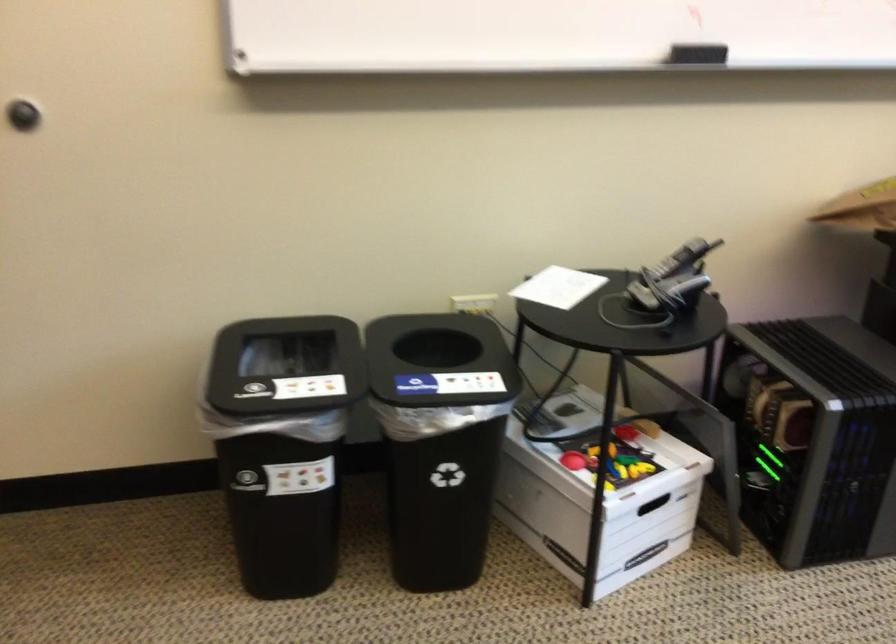
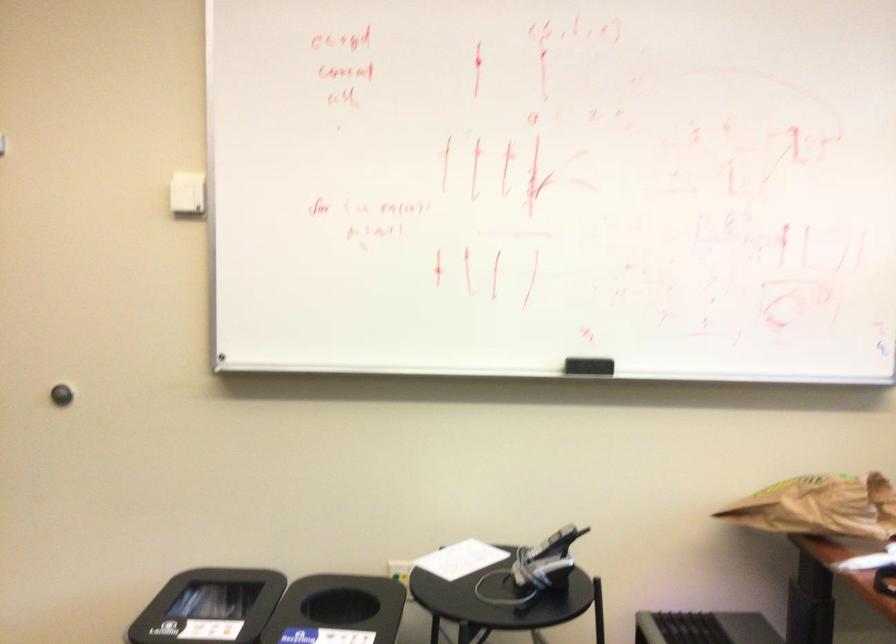
Question: I am providing you with two images of the same scene from different viewpoints. Please identify which objects are invisible in image2.

Choices:
 (A) white light switch
 (B) black board eraser
 (C) phone handset
 (D) none of these

Answer: (D)